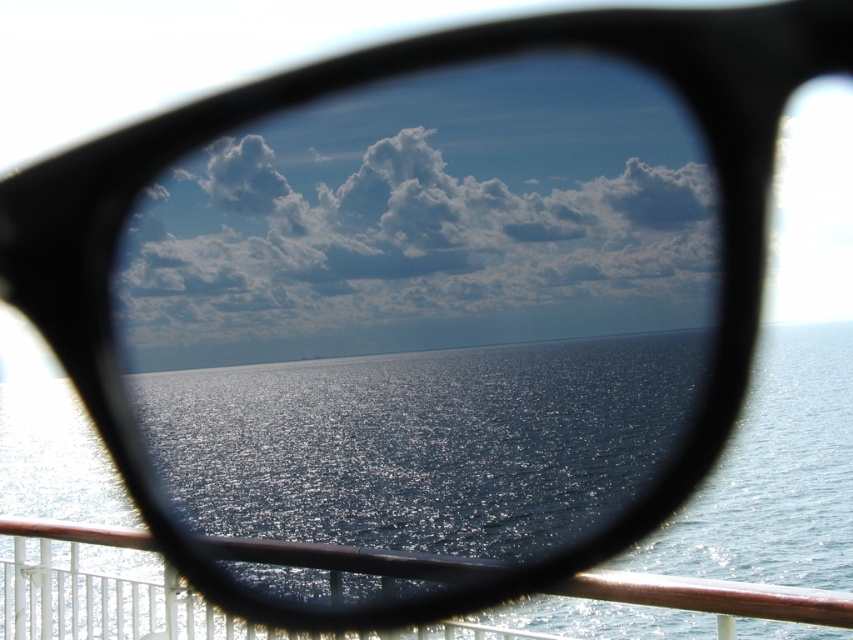
Question: Does glistening blue water at center have a lesser width compared to metallic brown railing at lower center?

Choices:
 (A) yes
 (B) no

Answer: (B)

Question: Is glistening blue water at center wider than metallic brown railing at lower center?

Choices:
 (A) no
 (B) yes

Answer: (B)

Question: Which object is the closest to the metallic brown railing at lower center?

Choices:
 (A) white fluffy cloud at upper center
 (B) glistening blue water at center

Answer: (B)

Question: Is white fluffy cloud at upper center positioned before glistening blue water at center?

Choices:
 (A) yes
 (B) no

Answer: (B)

Question: Which point is closer to the camera taking this photo?

Choices:
 (A) (579, 195)
 (B) (27, 435)

Answer: (B)

Question: Which object is positioned closest to the metallic brown railing at lower center?

Choices:
 (A) glistening blue water at center
 (B) white fluffy cloud at upper center

Answer: (A)